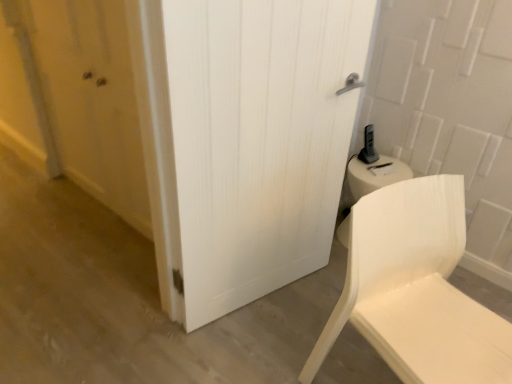
Question: Is matte wooden door at left shorter than white matte chair at lower right?

Choices:
 (A) yes
 (B) no

Answer: (B)

Question: Can you confirm if matte wooden door at left is bigger than white matte chair at lower right?

Choices:
 (A) yes
 (B) no

Answer: (B)

Question: Is matte wooden door at left oriented away from white matte chair at lower right?

Choices:
 (A) no
 (B) yes

Answer: (A)

Question: Is white matte chair at lower right a part of matte wooden door at left?

Choices:
 (A) no
 (B) yes

Answer: (A)

Question: From a real-world perspective, is matte wooden door at left over white matte chair at lower right?

Choices:
 (A) yes
 (B) no

Answer: (A)

Question: Could you tell me if matte wooden door at left is facing white matte chair at lower right?

Choices:
 (A) no
 (B) yes

Answer: (A)

Question: Does matte wooden door at left have a lesser height compared to white wood door at center?

Choices:
 (A) yes
 (B) no

Answer: (A)

Question: Considering the relative sizes of matte wooden door at left and white wood door at center in the image provided, is matte wooden door at left wider than white wood door at center?

Choices:
 (A) no
 (B) yes

Answer: (A)

Question: Is matte wooden door at left oriented towards white wood door at center?

Choices:
 (A) no
 (B) yes

Answer: (A)

Question: Is matte wooden door at left completely or partially outside of white wood door at center?

Choices:
 (A) yes
 (B) no

Answer: (A)

Question: Is white wood door at center inside matte wooden door at left?

Choices:
 (A) no
 (B) yes

Answer: (A)

Question: From a real-world perspective, is matte wooden door at left under white wood door at center?

Choices:
 (A) no
 (B) yes

Answer: (B)

Question: Considering the relative positions of white wood door at center and white matte chair at lower right in the image provided, is white wood door at center to the left of white matte chair at lower right from the viewer's perspective?

Choices:
 (A) yes
 (B) no

Answer: (A)